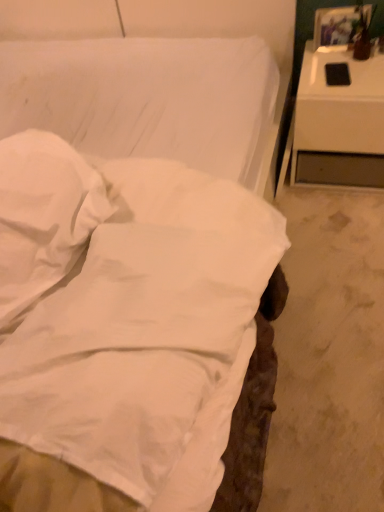
Question: Considering the relative sizes of matte brown vase at upper right and white glossy nightstand at right in the image provided, is matte brown vase at upper right thinner than white glossy nightstand at right?

Choices:
 (A) no
 (B) yes

Answer: (B)

Question: Is matte brown vase at upper right looking in the opposite direction of white glossy nightstand at right?

Choices:
 (A) yes
 (B) no

Answer: (B)

Question: From the image's perspective, is matte brown vase at upper right on white glossy nightstand at right?

Choices:
 (A) yes
 (B) no

Answer: (A)

Question: Considering the relative positions of matte brown vase at upper right and white glossy nightstand at right in the image provided, is matte brown vase at upper right behind white glossy nightstand at right?

Choices:
 (A) yes
 (B) no

Answer: (A)

Question: Could you tell me if matte brown vase at upper right is facing white glossy nightstand at right?

Choices:
 (A) yes
 (B) no

Answer: (B)

Question: Is matte brown vase at upper right at the left side of white glossy nightstand at right?

Choices:
 (A) no
 (B) yes

Answer: (A)

Question: Is the surface of matte brown vase at upper right in direct contact with white soft pillow at center?

Choices:
 (A) no
 (B) yes

Answer: (A)

Question: Can you confirm if matte brown vase at upper right is smaller than white soft pillow at center?

Choices:
 (A) no
 (B) yes

Answer: (B)

Question: Considering the relative positions of matte brown vase at upper right and white soft pillow at center in the image provided, is matte brown vase at upper right to the right of white soft pillow at center from the viewer's perspective?

Choices:
 (A) yes
 (B) no

Answer: (A)

Question: Does matte brown vase at upper right appear on the left side of white soft pillow at center?

Choices:
 (A) yes
 (B) no

Answer: (B)

Question: Could white soft pillow at center be considered to be inside matte brown vase at upper right?

Choices:
 (A) no
 (B) yes

Answer: (A)

Question: Is matte brown vase at upper right taller than white soft pillow at center?

Choices:
 (A) no
 (B) yes

Answer: (B)

Question: Is white glossy nightstand at right smaller than matte brown vase at upper right?

Choices:
 (A) yes
 (B) no

Answer: (B)